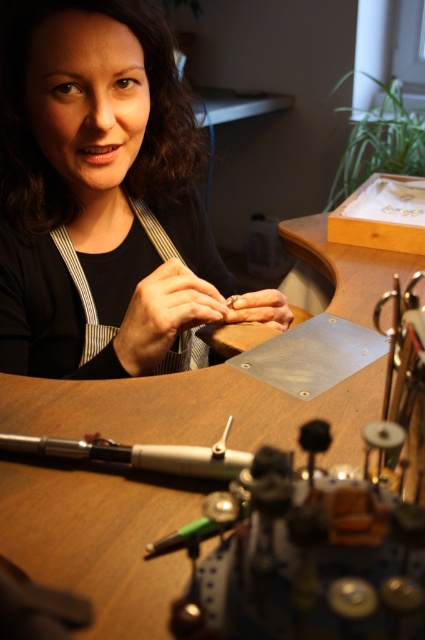
Question: Among these points, which one is nearest to the camera?

Choices:
 (A) (115, 200)
 (B) (136, 321)

Answer: (B)

Question: Does matte black apron at center appear on the left side of metallic silver pen at center?

Choices:
 (A) yes
 (B) no

Answer: (A)

Question: Does wooden table at center have a larger size compared to metallic silver pen at center?

Choices:
 (A) no
 (B) yes

Answer: (B)

Question: Which object is farther from the camera taking this photo?

Choices:
 (A) matte silver tool at center
 (B) metallic silver pen at center
 (C) matte black apron at center

Answer: (A)

Question: Can you confirm if matte black apron at center is positioned below matte silver tool at center?

Choices:
 (A) no
 (B) yes

Answer: (A)

Question: Which object is the closest to the matte silver tool at center?

Choices:
 (A) matte gold ring at center
 (B) wooden table at center
 (C) matte black apron at center

Answer: (A)